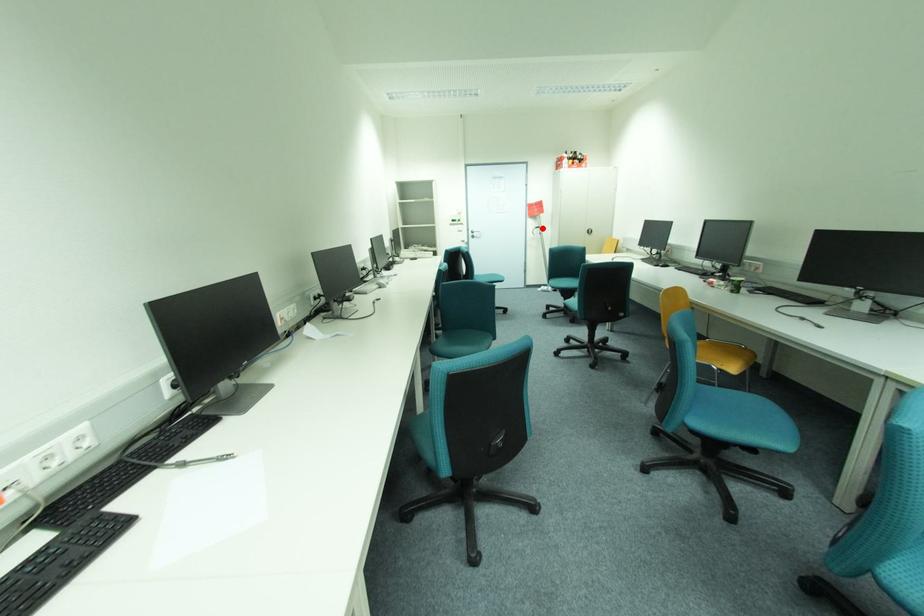
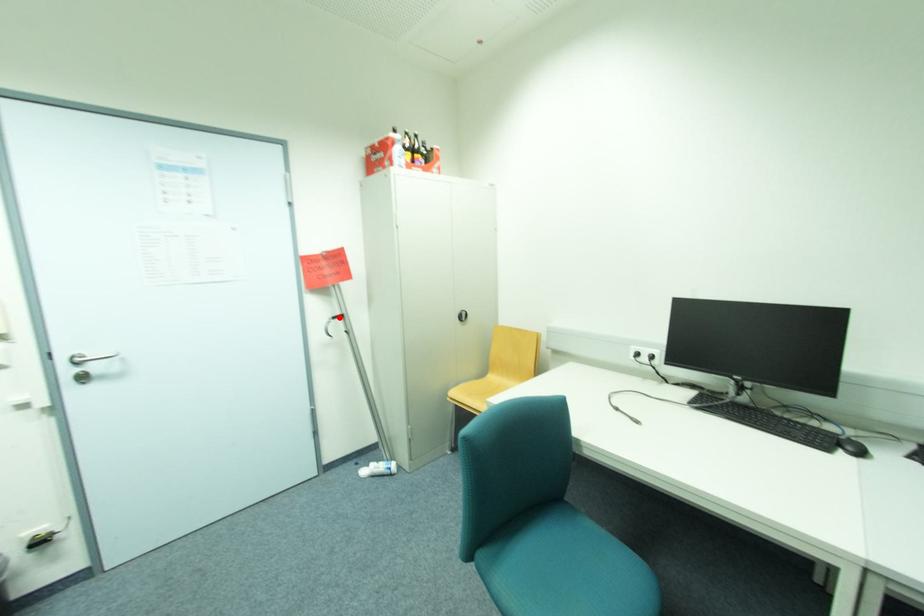
I am providing you with two images of the same scene from different viewpoints. A red point is marked on the first image and another point is marked on the second image. Are the points marked in image1 and image2 representing the same 3D position?

Yes